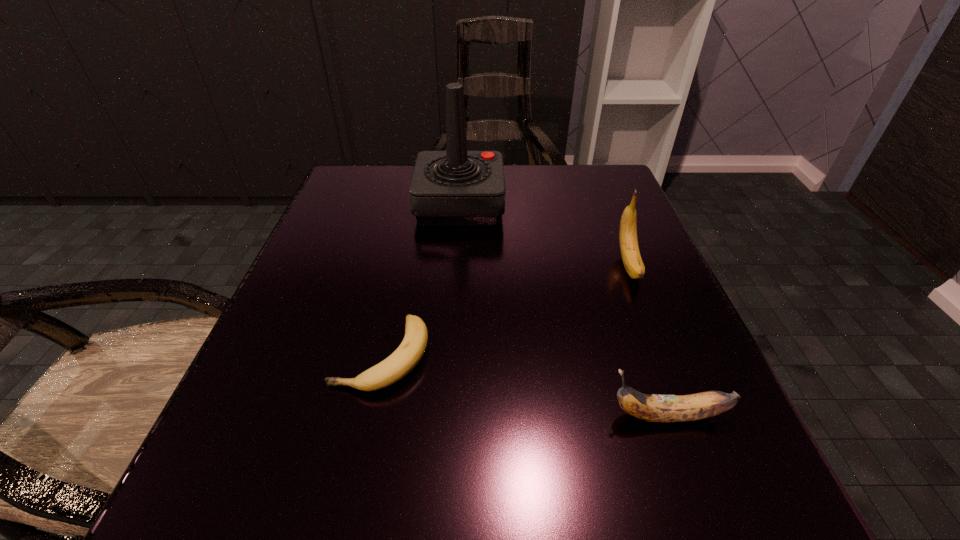
Locate an element on the screen. This screenshot has height=540, width=960. the tallest object is located at coordinates (456, 187).

The width and height of the screenshot is (960, 540). What are the coordinates of `joystick` in the screenshot? It's located at (456, 187).

You are a GUI agent. You are given a task and a screenshot of the screen. Output one action in this format:
    pyautogui.click(x=<x>, y=<y>)
    Task: Click on the tallest banana
    
    Given the screenshot: What is the action you would take?
    pyautogui.click(x=629, y=248)

Locate an element on the screen. This screenshot has height=540, width=960. the third shortest object is located at coordinates (629, 248).

Find the location of `the nearest object`. the nearest object is located at coordinates (653, 408).

At what (x,y) coordinates should I click in order to perform the action: click on the third tallest object. Please return your answer as a coordinate pair (x, y). Image resolution: width=960 pixels, height=540 pixels. Looking at the image, I should click on (653, 408).

Locate an element on the screen. the shortest object is located at coordinates (403, 360).

What are the coordinates of `the shortest banana` in the screenshot? It's located at (403, 360).

The image size is (960, 540). In order to click on vacant point located 0.170m on the front-facing side of the tallest object in this screenshot , I will do `click(582, 205)`.

This screenshot has width=960, height=540. What are the coordinates of `free spot located 0.250m at the start of the peel on the tallest banana` in the screenshot? It's located at (694, 427).